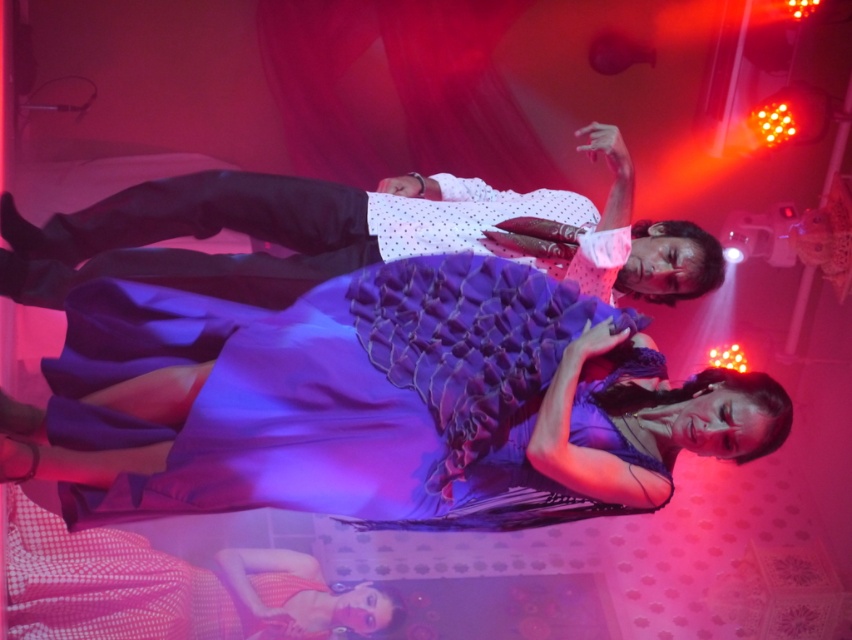
Which is in front, point (751, 435) or point (6, 195)?

Positioned in front is point (751, 435).

Between purple tulle dress at center and matte white shirt at upper center, which one appears on the right side from the viewer's perspective?

purple tulle dress at center is more to the right.

Which is in front, point (671, 429) or point (29, 230)?

Point (671, 429)

Where is `purple tulle dress at center`? Image resolution: width=852 pixels, height=640 pixels. purple tulle dress at center is located at coordinates (383, 403).